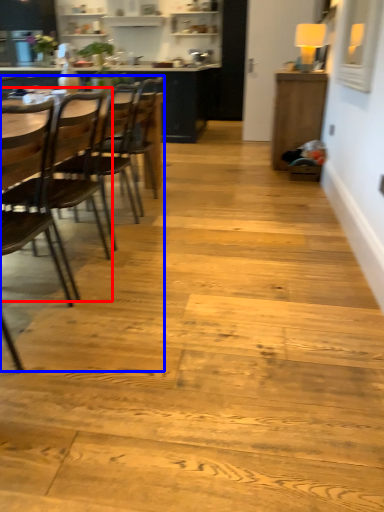
Question: Which point is further to the camera, chair (highlighted by a red box) or armchair (highlighted by a blue box)?

Choices:
 (A) chair
 (B) armchair

Answer: (A)